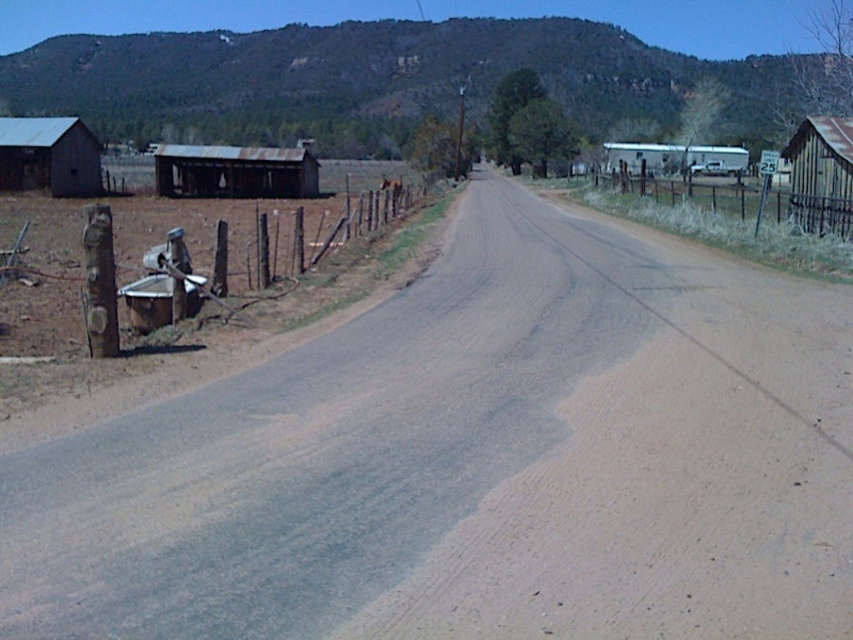
You are a hiker standing on the dirt road and want to climb the green grassy hill at upper center. Can you see the rusty metal fence at right from the top of the hill?

The green grassy hill at upper center is taller than the rusty metal fence at right, so yes, you can see the rusty metal fence at right from the top of the hill.

You are a delivery person trying to determine the best route to avoid obstacles. You see the weathered wood fence at left and the rusty metal shack at left. Which structure can you see the top of from your current position?

The weathered wood fence at left is shorter than the rusty metal shack at left, so you can see the top of the weathered wood fence at left but not the rusty metal shack at left.